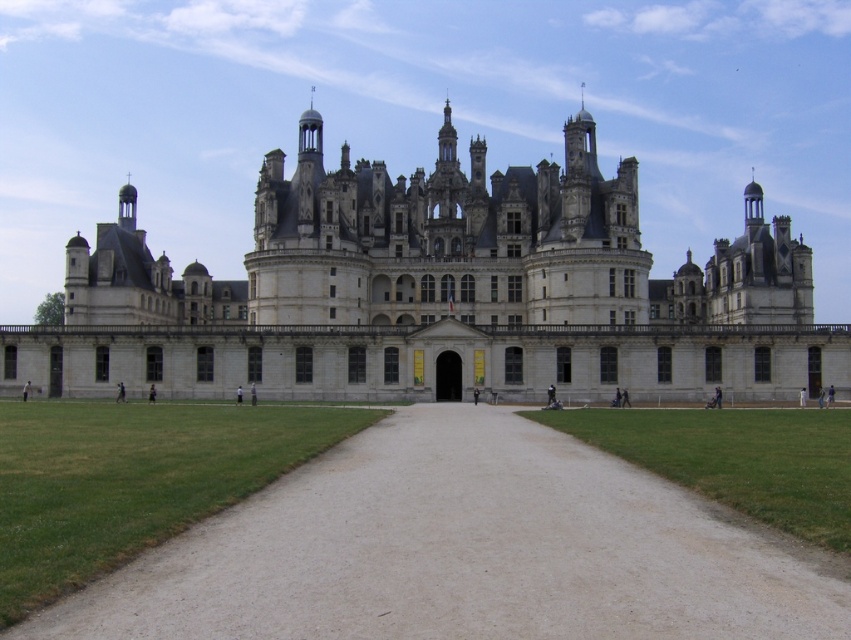
Question: Which object is closer to the camera taking this photo?

Choices:
 (A) dirt/gravel driveway at center
 (B) white stone castle at center

Answer: (A)

Question: Can you confirm if white stone castle at center is wider than dirt/gravel driveway at center?

Choices:
 (A) no
 (B) yes

Answer: (B)

Question: Which point appears closest to the camera in this image?

Choices:
 (A) (545, 595)
 (B) (448, 148)

Answer: (A)

Question: Does white stone castle at center have a smaller size compared to dirt/gravel driveway at center?

Choices:
 (A) yes
 (B) no

Answer: (B)

Question: Is white stone castle at center to the left of dirt/gravel driveway at center from the viewer's perspective?

Choices:
 (A) yes
 (B) no

Answer: (A)